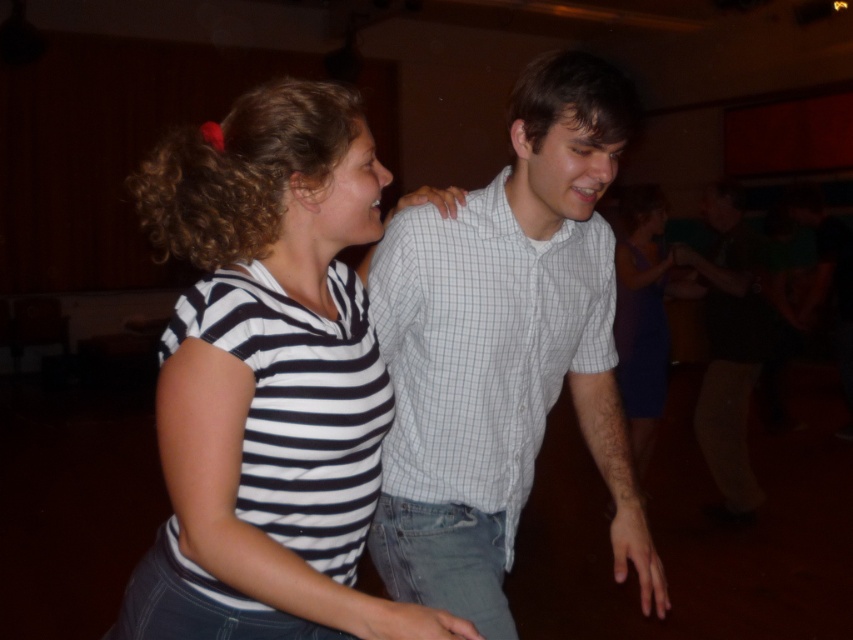
Identify the location of striped fabric shirt at center. (268, 380).

Does striped fabric shirt at center lie behind light blue checkered shirt at center?

No, striped fabric shirt at center is closer to the viewer.

Between point (157, 164) and point (735, 352), which one is positioned behind?

Positioned behind is point (735, 352).

At what (x,y) coordinates should I click in order to perform the action: click on striped fabric shirt at center. Please return your answer as a coordinate pair (x, y). Looking at the image, I should click on (268, 380).

Which is behind, point (369, 385) or point (438, 540)?

The point (438, 540) is behind.

Does striped fabric shirt at center appear on the right side of white checkered shirt at center?

In fact, striped fabric shirt at center is to the left of white checkered shirt at center.

Does point (212, 477) lie behind point (399, 248)?

No, (212, 477) is in front of (399, 248).

Where is `striped fabric shirt at center`? Image resolution: width=853 pixels, height=640 pixels. striped fabric shirt at center is located at coordinates (268, 380).

Does white checkered shirt at center have a lesser height compared to purple satin dress at center?

Indeed, white checkered shirt at center has a lesser height compared to purple satin dress at center.

Who is more distant from viewer, [486,586] or [647,401]?

The point [647,401] is behind.

Is point (502, 627) in front of point (657, 214)?

That is True.

Locate an element on the screen. This screenshot has width=853, height=640. white checkered shirt at center is located at coordinates (503, 349).